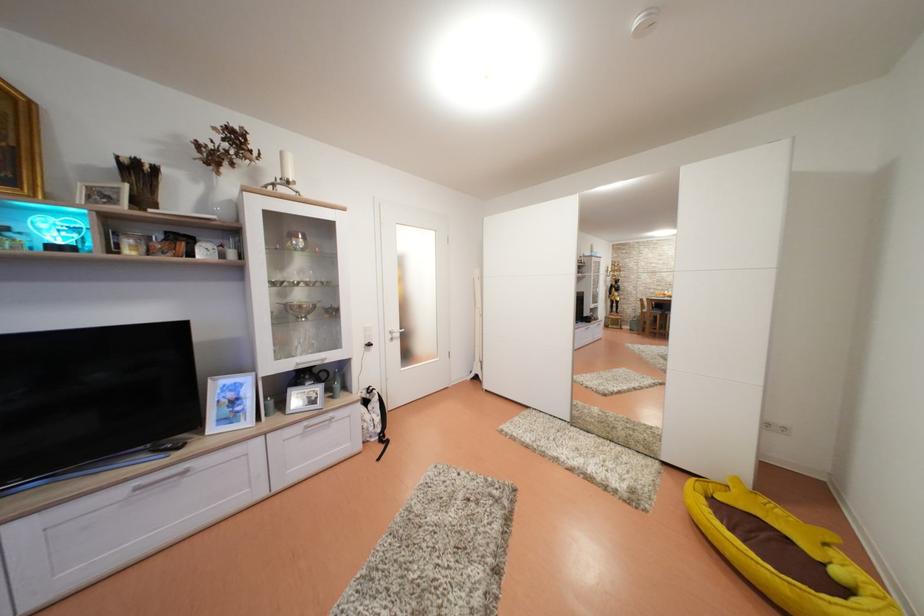
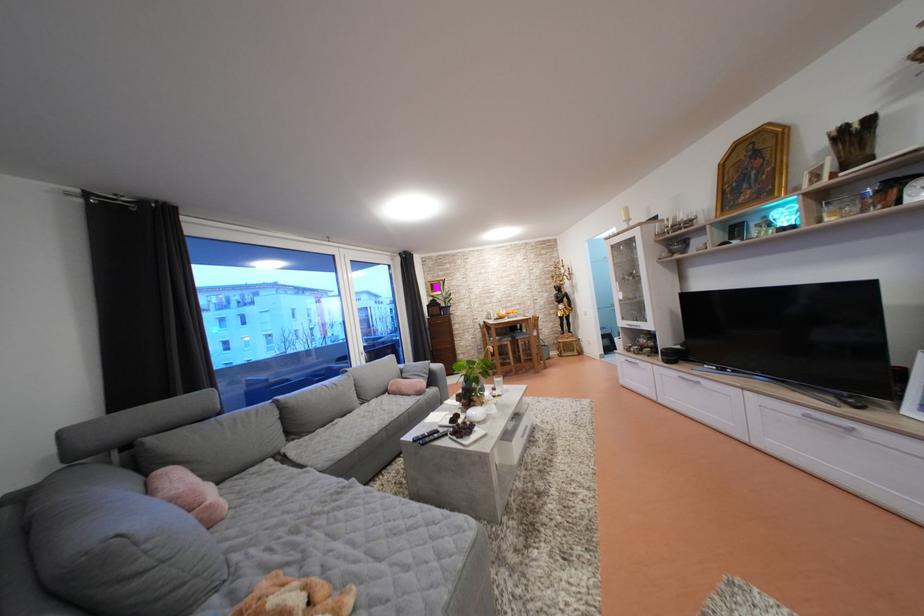
Find the pixel in the second image that matches pixel 130 496 in the first image.

(805, 416)